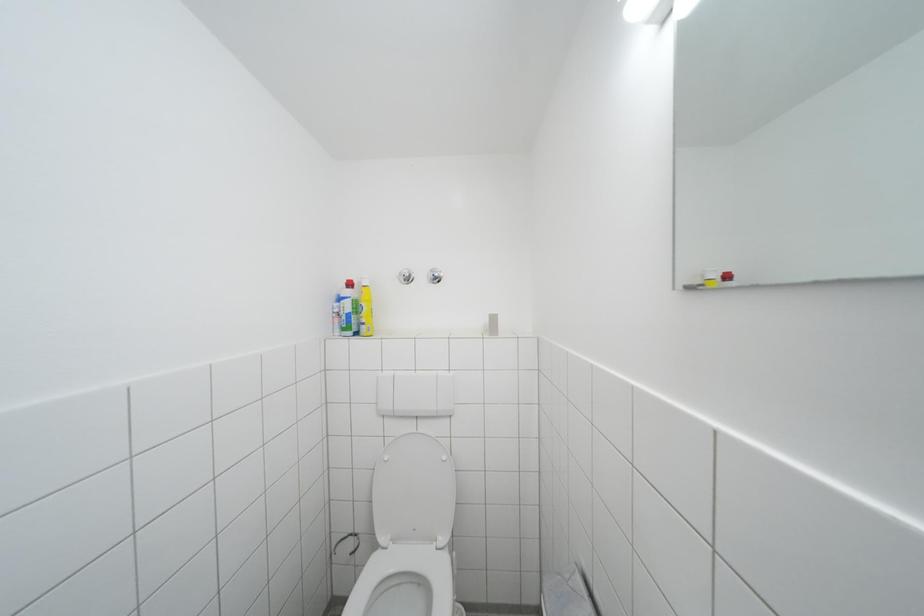
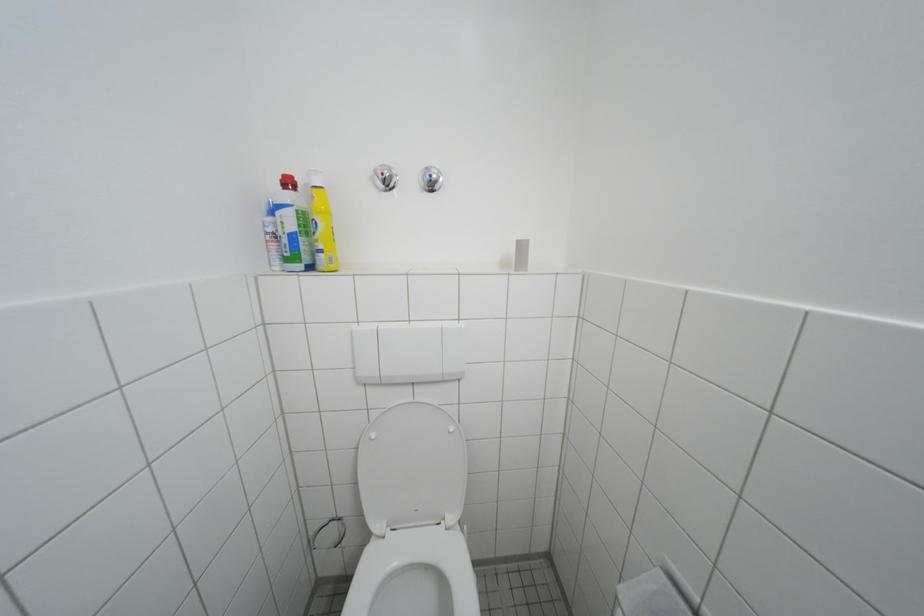
What movement of the cameraman would produce the second image?

The cameraman walked toward left, forward.